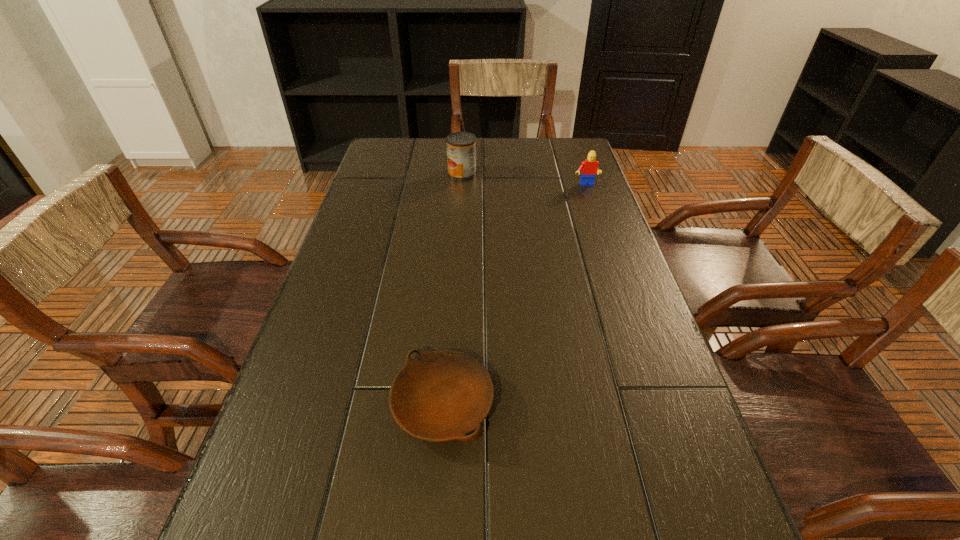
Select which object appears as the second closest to the can. Please provide its 2D coordinates. Your answer should be formatted as a tuple, i.e. [(x, y)], where the tuple contains the x and y coordinates of a point satisfying the conditions above.

[(444, 395)]

I want to click on object identified as the closest to the farthest object, so (589, 168).